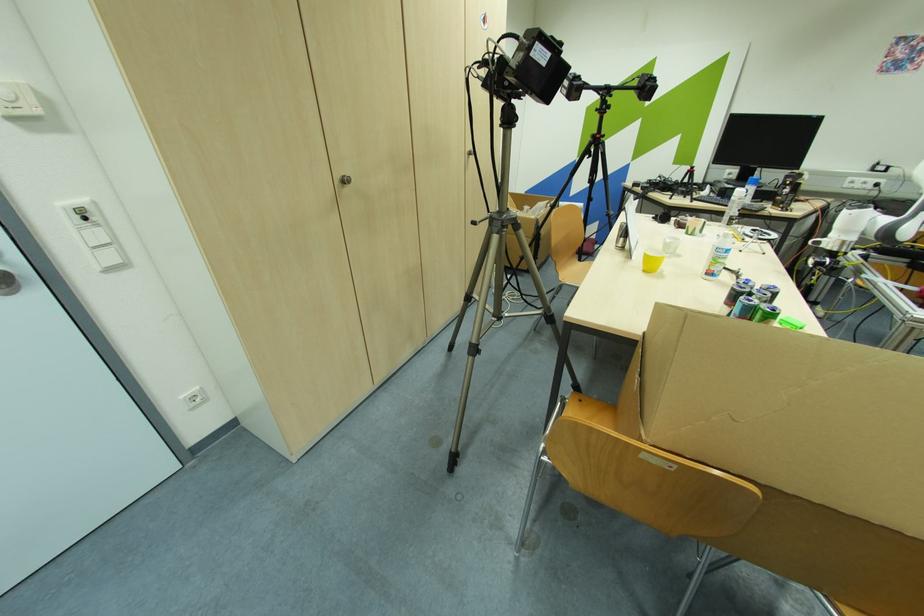
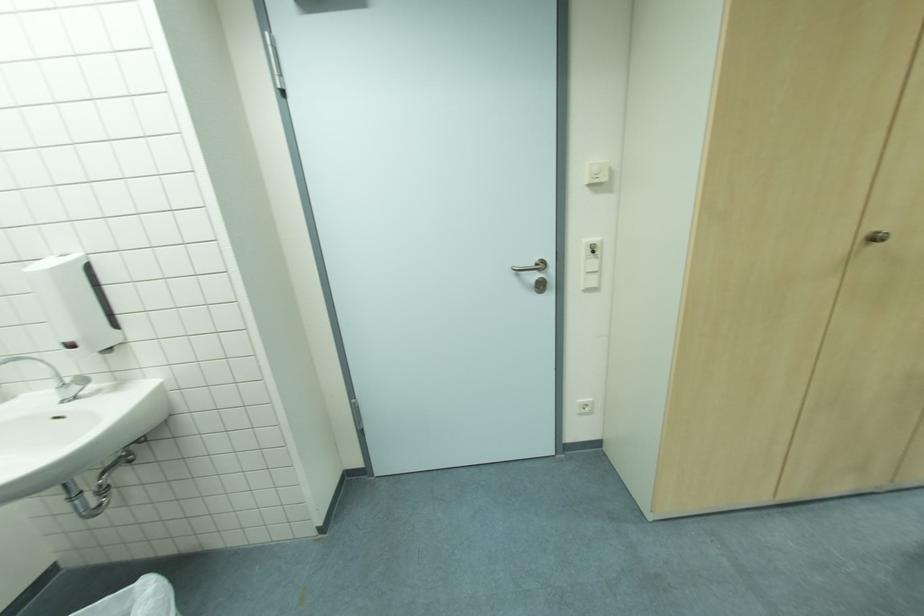
Question: The images are taken continuously from a first-person perspective. In which direction is your viewpoint rotating?

Choices:
 (A) Left
 (B) Right
 (C) Up
 (D) Down

Answer: (A)